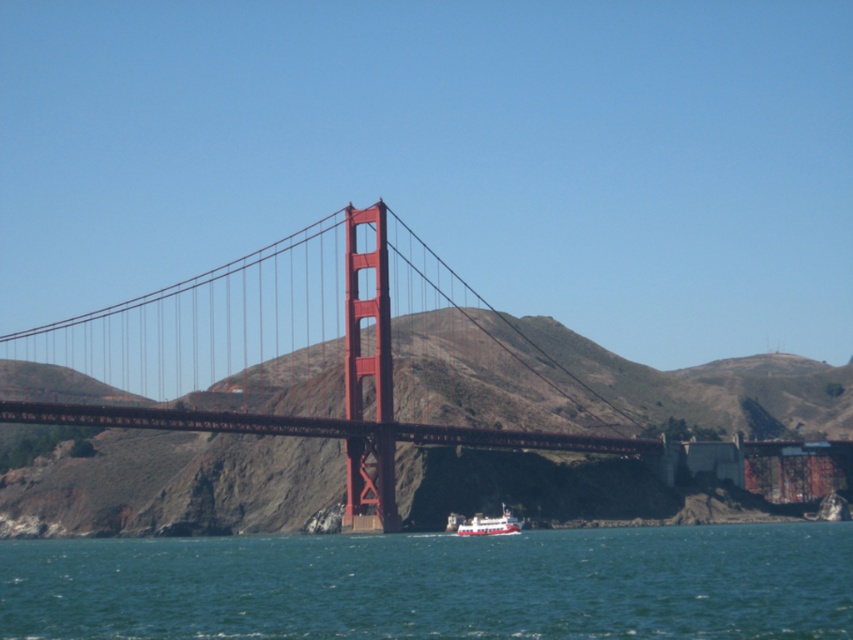
Which of these two, blue water at lower center or white plastic boat at lower center, stands shorter?

white plastic boat at lower center is shorter.

Is blue water at lower center wider than white plastic boat at lower center?

Correct, the width of blue water at lower center exceeds that of white plastic boat at lower center.

Where is `blue water at lower center`? blue water at lower center is located at coordinates (438, 584).

Can you confirm if glossy steel bridge at center is thinner than white plastic boat at lower center?

No, glossy steel bridge at center is not thinner than white plastic boat at lower center.

Can you confirm if glossy steel bridge at center is taller than white plastic boat at lower center?

Yes, glossy steel bridge at center is taller than white plastic boat at lower center.

In order to click on glossy steel bridge at center in this screenshot , I will do `click(380, 403)`.

I want to click on glossy steel bridge at center, so click(x=380, y=403).

Between glossy steel bridge at center and blue water at lower center, which one has more height?

glossy steel bridge at center

Is glossy steel bridge at center smaller than blue water at lower center?

Incorrect, glossy steel bridge at center is not smaller in size than blue water at lower center.

The width and height of the screenshot is (853, 640). In order to click on glossy steel bridge at center in this screenshot , I will do `click(380, 403)`.